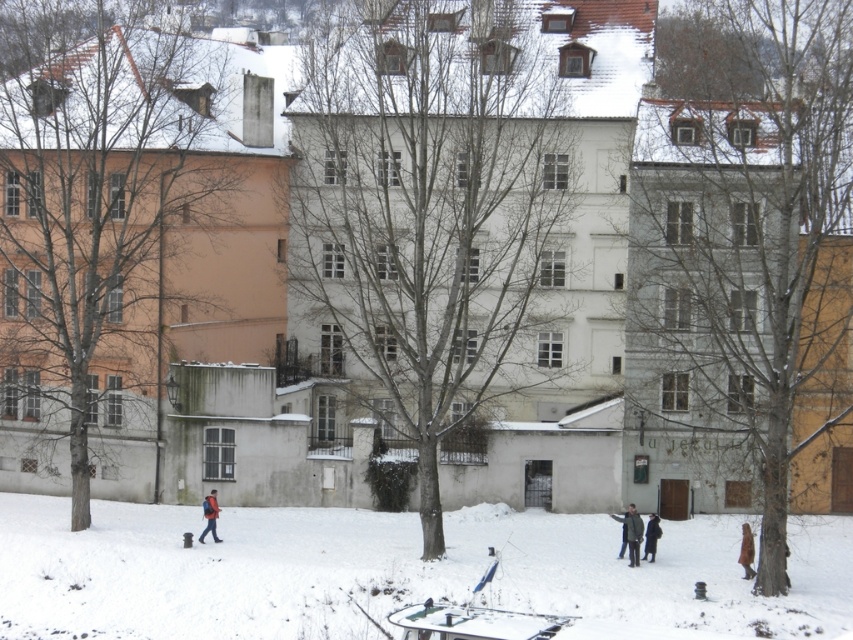
Question: Which point is closer to the camera taking this photo?

Choices:
 (A) (218, 538)
 (B) (633, 548)
 (C) (750, 536)

Answer: (C)

Question: Is white powdery snow at lower left to the left of red backpack at lower center from the viewer's perspective?

Choices:
 (A) yes
 (B) no

Answer: (B)

Question: Is white powdery snow at lower left below dark gray jacket at lower center?

Choices:
 (A) yes
 (B) no

Answer: (A)

Question: Can you confirm if brown wool coat at lower right is wider than dark wool coat at center?

Choices:
 (A) yes
 (B) no

Answer: (B)

Question: Which of the following is the closest to the observer?

Choices:
 (A) (746, 554)
 (B) (636, 518)
 (C) (213, 525)
 (D) (645, 531)

Answer: (A)

Question: Estimate the real-world distances between objects in this image. Which object is farther from the red backpack at lower center?

Choices:
 (A) dark gray jacket at lower center
 (B) white powdery snow at lower left
 (C) brown wool coat at lower right

Answer: (C)